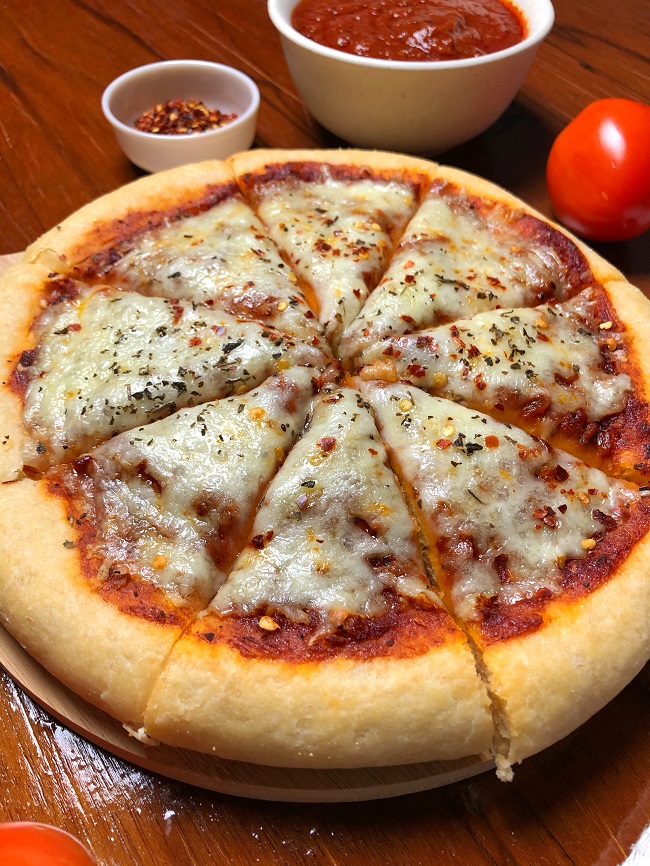
You are a GUI agent. You are given a task and a screenshot of the screen. Output one action in this format:
    pyautogui.click(x=<x>, y=<y>)
    Task: Click on the bowl
    
    Given the screenshot: What is the action you would take?
    pyautogui.click(x=474, y=89), pyautogui.click(x=229, y=107)